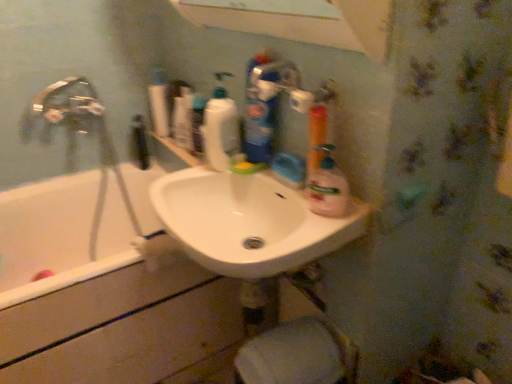
Find the location of a particular element. The image size is (512, 384). vacant point above white matte toilet paper at lower center (from a real-world perspective) is located at coordinates (284, 340).